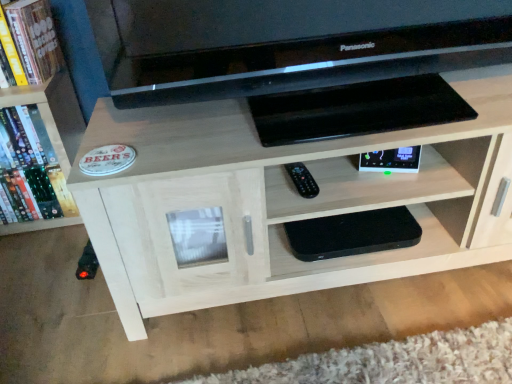
Question: Would you say hardcover book at upper left is inside or outside black plastic remote at center?

Choices:
 (A) outside
 (B) inside

Answer: (A)

Question: Is hardcover book at upper left wider or thinner than black plastic remote at center?

Choices:
 (A) thin
 (B) wide

Answer: (B)

Question: Which object is the farthest from the black matte speaker at lower center, the 2th shelf in the top-to-bottom sequence?

Choices:
 (A) hardcover book at upper left
 (B) light wood shelf at center, the 1th shelf viewed from the top
 (C) black glossy tv at upper center
 (D) wooden bookshelf at left
 (E) black plastic remote at center

Answer: (A)

Question: Based on their relative distances, which object is farther from the light wood shelf at center, acting as the 2th shelf starting from the bottom?

Choices:
 (A) black plastic remote at center
 (B) black glossy tv at upper center
 (C) black matte speaker at lower center, the 2th shelf in the top-to-bottom sequence
 (D) hardcover book at upper left
 (E) wooden bookshelf at left

Answer: (D)